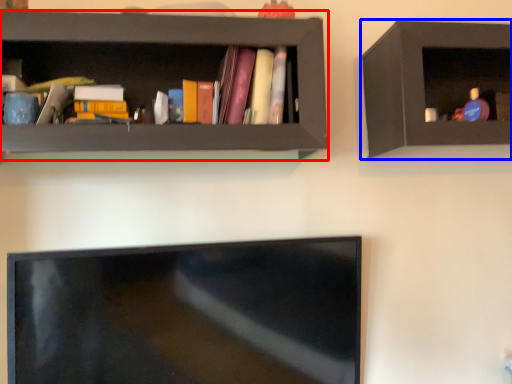
Question: Which object appears farthest to the camera in this image, shelf (highlighted by a red box) or shelf (highlighted by a blue box)?

Choices:
 (A) shelf
 (B) shelf

Answer: (B)